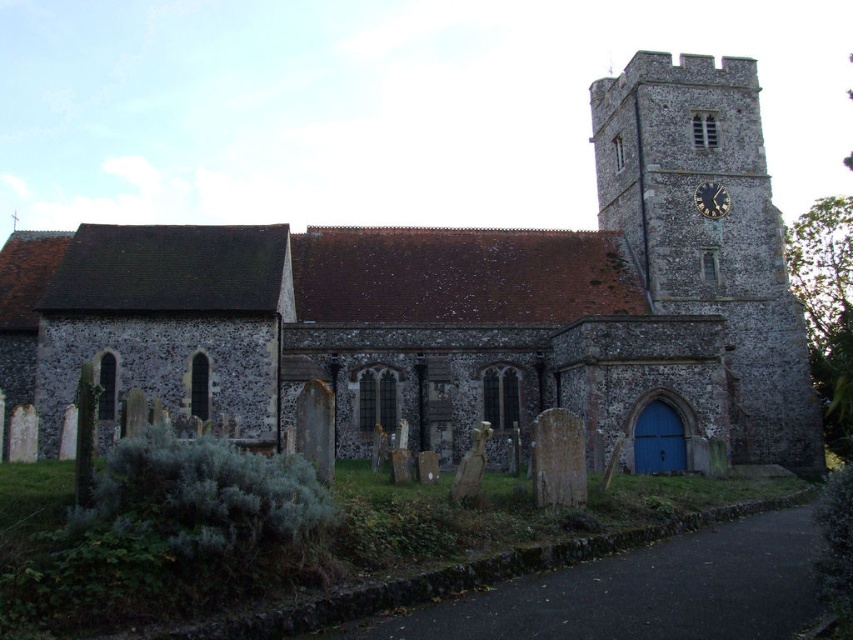
Who is positioned more to the right, stone church at center or stone clock tower at upper right?

stone clock tower at upper right

Can you confirm if stone church at center is taller than stone clock tower at upper right?

No.

Between point (241, 356) and point (651, 276), which one is positioned behind?

The point (651, 276) is behind.

This screenshot has width=853, height=640. Find the location of `stone church at center`. stone church at center is located at coordinates (459, 305).

Between stone clock tower at upper right and gold metallic clock at upper right, which one has less height?

gold metallic clock at upper right is shorter.

Is stone clock tower at upper right above gold metallic clock at upper right?

Incorrect, stone clock tower at upper right is not positioned above gold metallic clock at upper right.

At what (x,y) coordinates should I click in order to perform the action: click on stone clock tower at upper right. Please return your answer as a coordinate pair (x, y). The image size is (853, 640). Looking at the image, I should click on (711, 236).

Who is lower down, stone church at center or gold metallic clock at upper right?

Positioned lower is stone church at center.

Is point (212, 390) less distant than point (712, 209)?

That is True.

Which is in front, point (679, 310) or point (717, 189)?

Point (679, 310) is in front.

This screenshot has height=640, width=853. Identify the location of stone church at center. (459, 305).